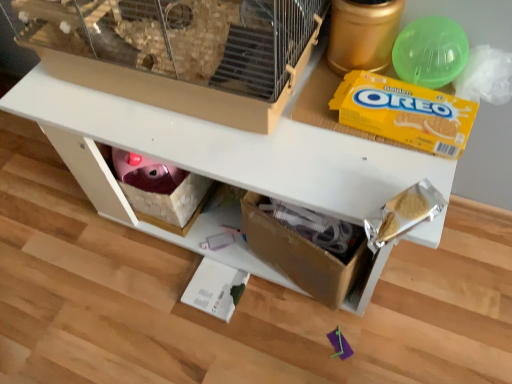
Identify the location of vacant space to the left of green plastic ball at upper right. The width and height of the screenshot is (512, 384). (327, 106).